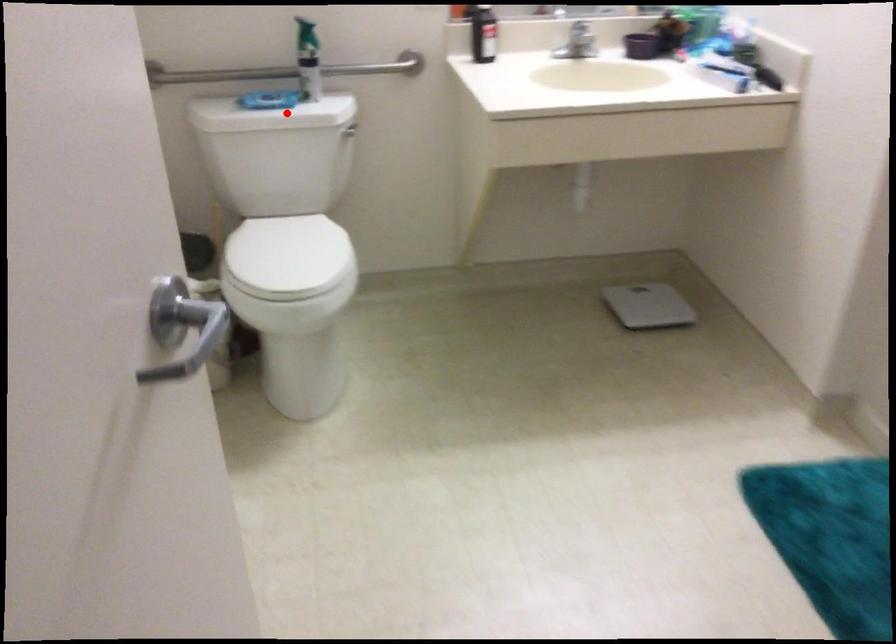
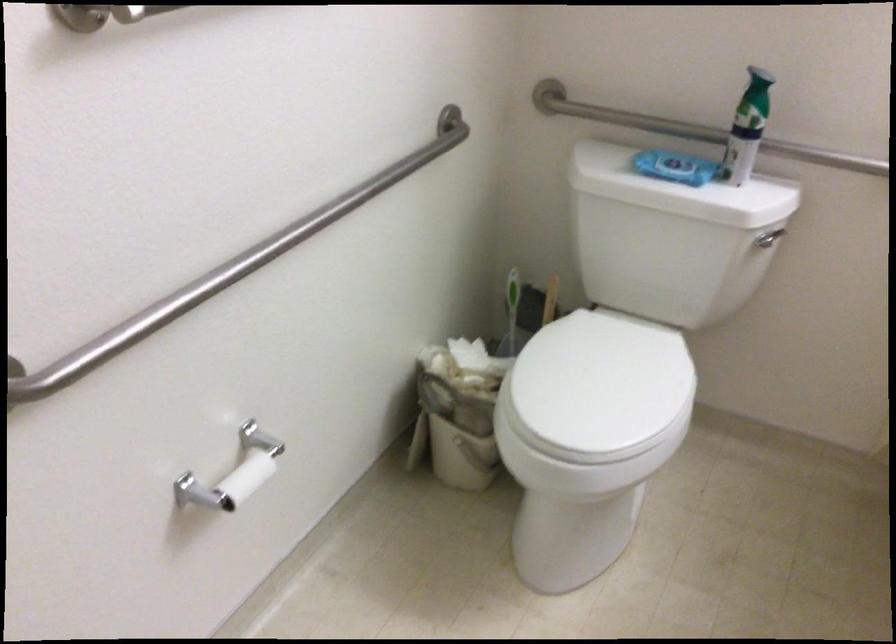
Question: I am providing you with two images of the same scene from different viewpoints. A red point is shown in image1. For the corresponding object point in image2, is it positioned nearer or farther from the camera?

Choices:
 (A) Nearer
 (B) Farther

Answer: (A)